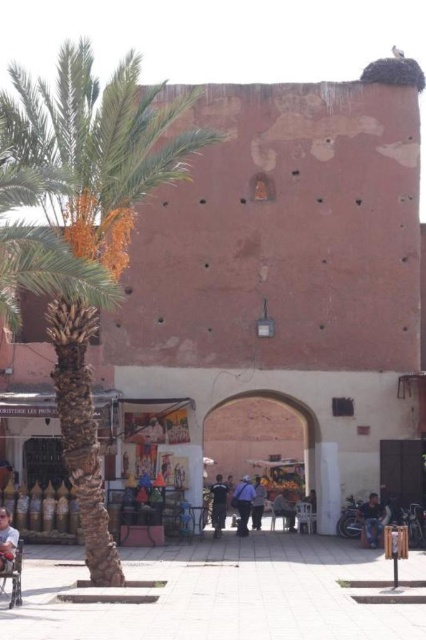
You are a tourist visiting this historic area and want to take a photo of the dark blue jeans at center without the brick archway at center appearing in the background. Is this possible based on their positions?

The brick archway at center is positioned over dark blue jeans at center, so it would block the view of the jeans if you are looking from below. To avoid the archway in the background, you might need to move to a position where the archway is not directly above the jeans.

You are a tourist standing in the plaza in front of the historic wall. You see the green leafy palm tree at left and the blue uniformed person at center. Which object is larger in size?

The green leafy palm tree at left is bigger than the blue uniformed person at center.